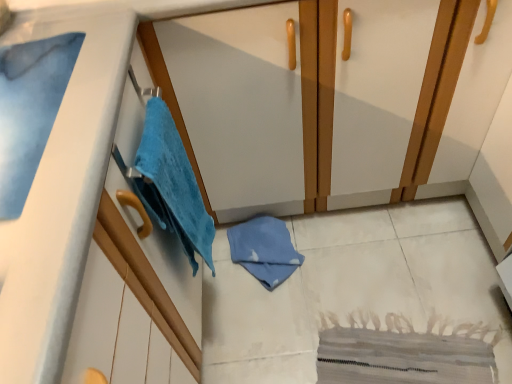
Question: Is matte white dresser at center turned away from blue soft towel at left?

Choices:
 (A) yes
 (B) no

Answer: (A)

Question: Can you confirm if matte white dresser at center is taller than blue soft towel at left?

Choices:
 (A) no
 (B) yes

Answer: (B)

Question: Can you confirm if matte white dresser at center is smaller than blue soft towel at left?

Choices:
 (A) no
 (B) yes

Answer: (A)

Question: From a real-world perspective, does matte white dresser at center stand above blue soft towel at left?

Choices:
 (A) no
 (B) yes

Answer: (A)

Question: Considering the relative sizes of matte white dresser at center and blue soft towel at left in the image provided, is matte white dresser at center shorter than blue soft towel at left?

Choices:
 (A) yes
 (B) no

Answer: (B)

Question: From the image's perspective, is matte white dresser at center located beneath blue soft towel at left?

Choices:
 (A) yes
 (B) no

Answer: (B)

Question: Can you confirm if blue soft towel at upper left is taller than blue soft towel at left?

Choices:
 (A) no
 (B) yes

Answer: (A)

Question: Is blue soft towel at upper left facing away from blue soft towel at left?

Choices:
 (A) no
 (B) yes

Answer: (A)

Question: Considering the relative sizes of blue soft towel at upper left and blue soft towel at left in the image provided, is blue soft towel at upper left shorter than blue soft towel at left?

Choices:
 (A) no
 (B) yes

Answer: (B)

Question: Would you say blue soft towel at left is part of blue soft towel at upper left's contents?

Choices:
 (A) no
 (B) yes

Answer: (A)

Question: Can you confirm if blue soft towel at upper left is thinner than blue soft towel at left?

Choices:
 (A) no
 (B) yes

Answer: (A)

Question: Is blue soft towel at upper left not close to blue soft towel at left?

Choices:
 (A) no
 (B) yes

Answer: (A)

Question: Does matte white dresser at center come behind blue soft towel at upper left?

Choices:
 (A) yes
 (B) no

Answer: (A)